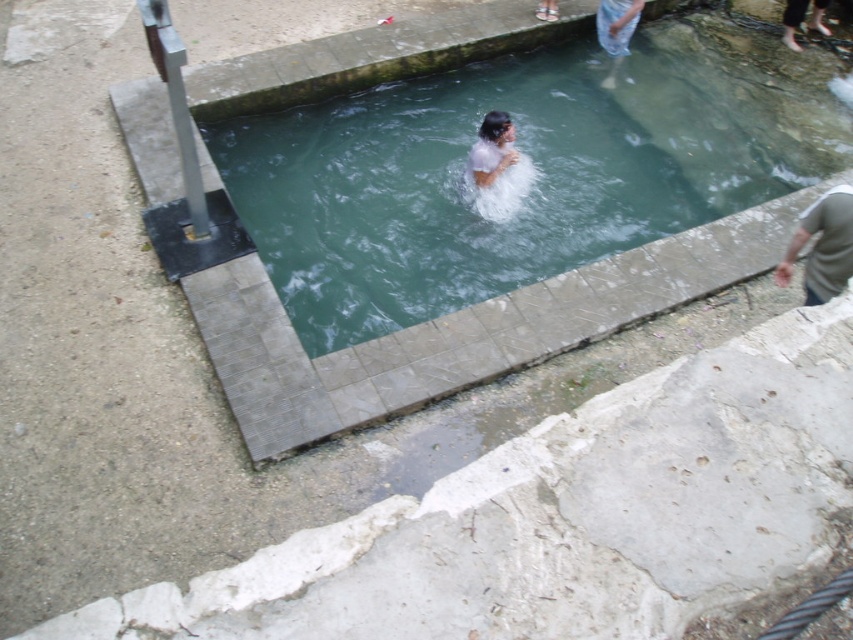
Which is more to the left, gray cotton shirt at lower right or blue denim jeans at upper right?

blue denim jeans at upper right is more to the left.

Does gray cotton shirt at lower right appear on the right side of blue denim jeans at upper right?

Indeed, gray cotton shirt at lower right is positioned on the right side of blue denim jeans at upper right.

Identify the location of gray cotton shirt at lower right. (822, 244).

Who is positioned more to the right, gray cotton shirt at lower right or white matte hair at center?

From the viewer's perspective, gray cotton shirt at lower right appears more on the right side.

Does gray cotton shirt at lower right have a greater width compared to white matte hair at center?

No.

Who is more forward, (805, 273) or (508, 161)?

Point (805, 273) is more forward.

Identify the location of gray cotton shirt at lower right. The image size is (853, 640). (822, 244).

Is point (461, 99) less distant than point (492, 141)?

No, (461, 99) is behind (492, 141).

Is point (477, 280) farther from viewer compared to point (495, 115)?

That is True.

You are a GUI agent. You are given a task and a screenshot of the screen. Output one action in this format:
    pyautogui.click(x=<x>, y=<y>)
    Task: Click on the green concrete pool at center
    The width and height of the screenshot is (853, 640).
    Given the screenshot: What is the action you would take?
    click(532, 164)